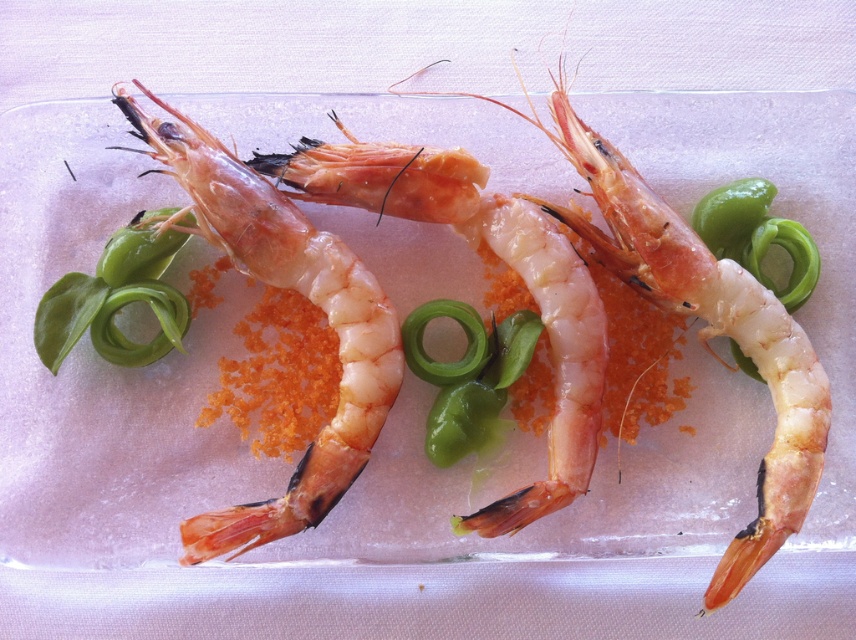
The width and height of the screenshot is (856, 640). Identify the location of pink translucent shrimp at center. [x=284, y=288].

The image size is (856, 640). In order to click on pink translucent shrimp at center in this screenshot , I will do `click(284, 288)`.

Measure the distance between point [434,150] and camera.

Point [434,150] is 3.94 feet away from camera.

How distant is pinkish translucent shrimp at center from green glossy vegetable at upper left?

11.06 inches

Which is in front, point (421, 161) or point (116, 362)?

Positioned in front is point (116, 362).

Locate an element on the screen. pinkish translucent shrimp at center is located at coordinates (501, 259).

Is point (703, 332) farther from viewer compared to point (768, 227)?

That is False.

Which is in front, point (663, 241) or point (809, 289)?

Point (663, 241) is more forward.

Who is more distant from viewer, (747, 545) or (715, 237)?

The point (715, 237) is behind.

You are a GUI agent. You are given a task and a screenshot of the screen. Output one action in this format:
    pyautogui.click(x=<x>, y=<y>)
    Task: Click on the translucent pink shrimp at center
    This screenshot has height=640, width=856.
    Given the screenshot: What is the action you would take?
    pyautogui.click(x=710, y=333)